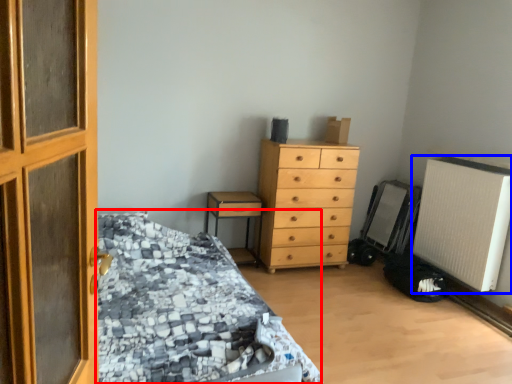
Question: Which object is closer to the camera taking this photo, bed (highlighted by a red box) or air conditioning (highlighted by a blue box)?

Choices:
 (A) bed
 (B) air conditioning

Answer: (A)